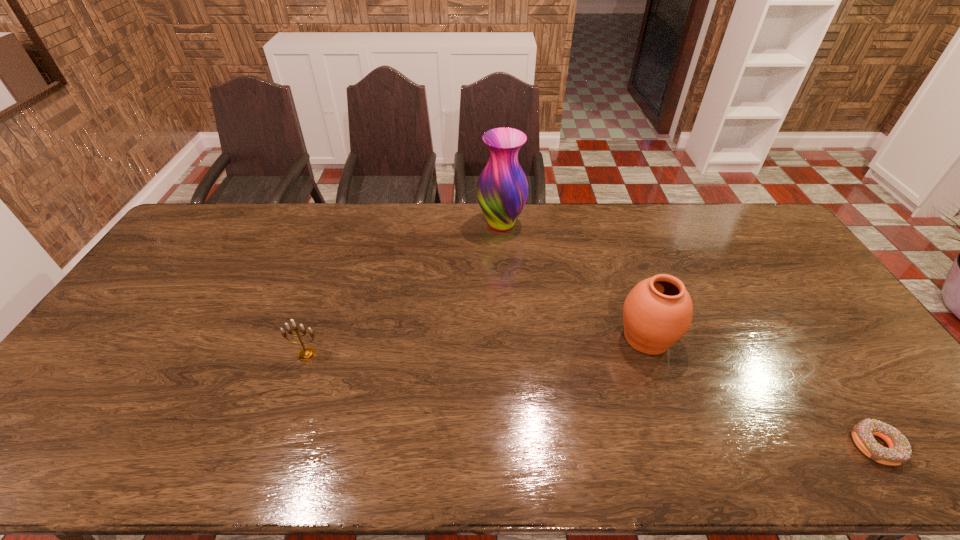
Locate an element on the screen. This screenshot has height=540, width=960. vase is located at coordinates (502, 189).

This screenshot has width=960, height=540. I want to click on the tallest object, so click(x=502, y=189).

Identify the location of the third shortest object. The width and height of the screenshot is (960, 540). (657, 312).

The image size is (960, 540). In order to click on urn in this screenshot , I will do `click(657, 312)`.

This screenshot has height=540, width=960. Find the location of `candelabrum`. candelabrum is located at coordinates (307, 353).

The width and height of the screenshot is (960, 540). Find the location of `the leftmost object`. the leftmost object is located at coordinates [307, 353].

You are a GUI agent. You are given a task and a screenshot of the screen. Output one action in this format:
    pyautogui.click(x=<x>, y=<y>)
    Task: Click on the nearest object
    This screenshot has height=540, width=960.
    Given the screenshot: What is the action you would take?
    pyautogui.click(x=899, y=452)

Where is `the rightmost object`? The width and height of the screenshot is (960, 540). the rightmost object is located at coordinates (899, 452).

Identify the location of vacant area located 0.340m on the front of the second object from left to right. The width and height of the screenshot is (960, 540). (506, 312).

Where is `vacant area situated on the front of the third object from left to right`? This screenshot has height=540, width=960. vacant area situated on the front of the third object from left to right is located at coordinates (680, 434).